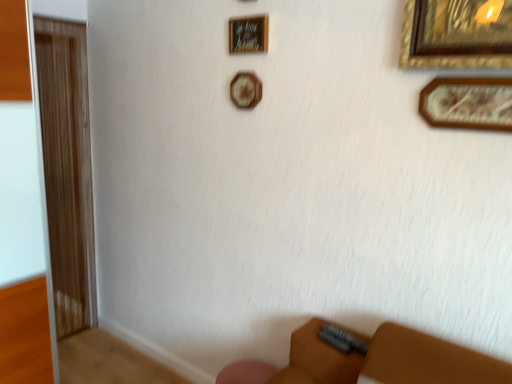
Question: Is wooden picture frame at upper right, which is the third picture frame from back to front, located within brown wood screen door at left?

Choices:
 (A) no
 (B) yes

Answer: (A)

Question: Is brown wood screen door at left placed right next to wooden picture frame at upper right, the 1th picture frame when ordered from right to left?

Choices:
 (A) yes
 (B) no

Answer: (B)

Question: Can you confirm if brown wood screen door at left is smaller than wooden picture frame at upper right, which is the third picture frame from back to front?

Choices:
 (A) no
 (B) yes

Answer: (A)

Question: Would you say brown wood screen door at left is a long distance from wooden picture frame at upper right, which is the third picture frame from back to front?

Choices:
 (A) no
 (B) yes

Answer: (B)

Question: Considering the relative positions of brown wood screen door at left and wooden picture frame at upper right, acting as the 3th picture frame starting from the top, in the image provided, is brown wood screen door at left in front of wooden picture frame at upper right, acting as the 3th picture frame starting from the top,?

Choices:
 (A) yes
 (B) no

Answer: (B)

Question: Is brown wood screen door at left taller than wooden picture frame at upper right, the first picture frame from the bottom?

Choices:
 (A) yes
 (B) no

Answer: (A)

Question: Considering the relative sizes of brown wood screen door at left and wooden picture frame at upper center, the first picture frame positioned from the back, in the image provided, is brown wood screen door at left bigger than wooden picture frame at upper center, the first picture frame positioned from the back,?

Choices:
 (A) no
 (B) yes

Answer: (B)

Question: From the image's perspective, is brown wood screen door at left on top of wooden picture frame at upper center, which ranks as the 3th picture frame in front-to-back order?

Choices:
 (A) no
 (B) yes

Answer: (A)

Question: Is brown wood screen door at left turned away from wooden picture frame at upper center, which is counted as the second picture frame, starting from the bottom?

Choices:
 (A) yes
 (B) no

Answer: (B)

Question: From a real-world perspective, is brown wood screen door at left below wooden picture frame at upper center, which is counted as the second picture frame, starting from the bottom?

Choices:
 (A) yes
 (B) no

Answer: (A)

Question: Are brown wood screen door at left and wooden picture frame at upper center, arranged as the 2th picture frame when viewed from the top, making contact?

Choices:
 (A) yes
 (B) no

Answer: (B)

Question: From the image's perspective, does brown wood screen door at left appear lower than wooden picture frame at upper center, which is counted as the second picture frame, starting from the bottom?

Choices:
 (A) yes
 (B) no

Answer: (A)

Question: Can you confirm if wooden picture frame at upper center, which ranks as the 3th picture frame in front-to-back order, is taller than wooden picture frame at upper right, the 1th picture frame when ordered from right to left?

Choices:
 (A) yes
 (B) no

Answer: (B)